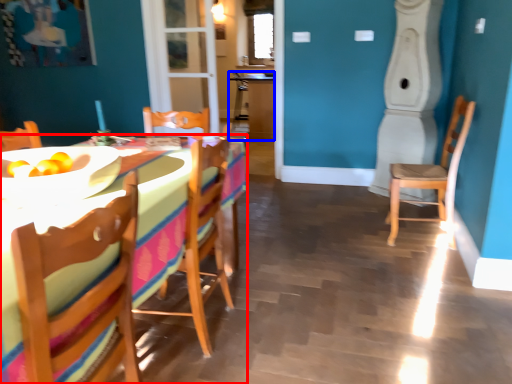
Question: Which object appears farthest to the camera in this image, desk (highlighted by a red box) or table (highlighted by a blue box)?

Choices:
 (A) desk
 (B) table

Answer: (B)